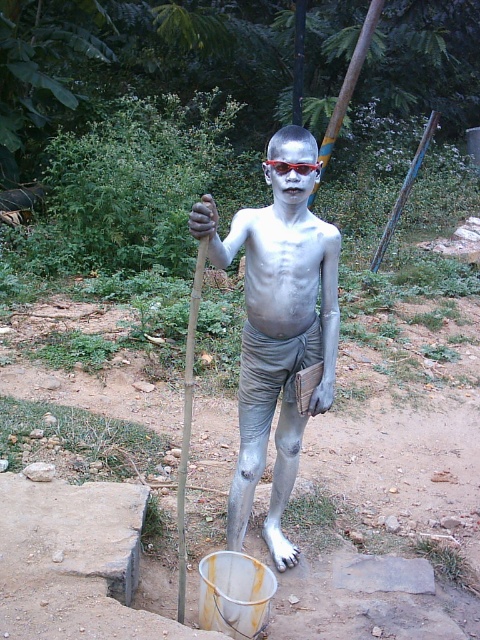
Can you confirm if matte silver body paint at center is smaller than red plastic goggles at center?

Actually, matte silver body paint at center might be larger than red plastic goggles at center.

Is point (278, 376) positioned after point (289, 164)?

Yes, point (278, 376) is farther from viewer.

Locate an element on the screen. The height and width of the screenshot is (640, 480). matte silver body paint at center is located at coordinates (276, 337).